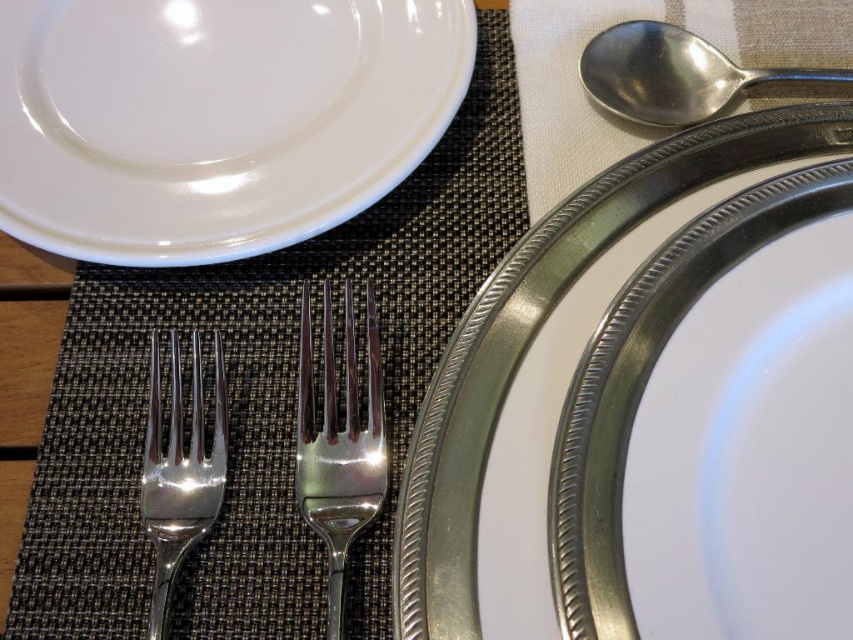
Question: Which object is the closest to the metallic silver plate at center?

Choices:
 (A) polished silver fork at center-left
 (B) polished silver fork at center

Answer: (B)

Question: Which object is the closest to the white glossy plate at upper left?

Choices:
 (A) polished silver fork at center
 (B) metallic silver plate at center
 (C) silver metallic spoon at upper right
 (D) polished silver fork at center-left

Answer: (A)

Question: Does white glossy plate at upper left have a larger size compared to silver metallic spoon at upper right?

Choices:
 (A) yes
 (B) no

Answer: (A)

Question: Which point appears farthest from the camera in this image?

Choices:
 (A) (195, 336)
 (B) (604, 84)
 (C) (444, 545)

Answer: (B)

Question: Does silver metallic spoon at upper right have a smaller size compared to polished silver fork at center-left?

Choices:
 (A) no
 (B) yes

Answer: (A)

Question: Does metallic silver plate at center have a larger size compared to polished silver fork at center-left?

Choices:
 (A) yes
 (B) no

Answer: (A)